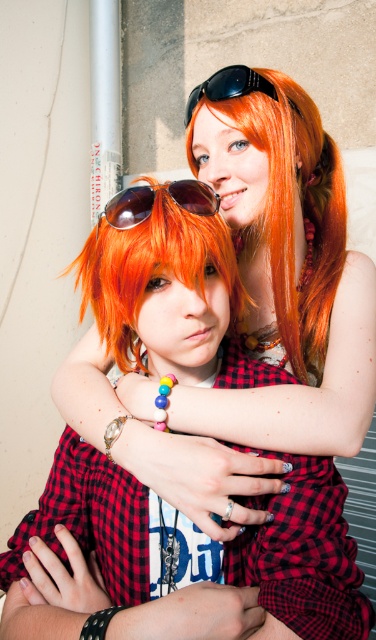
In the scene, you see an orange matte wig at center and sunglasses at center. Which object is positioned to the right of the other?

The orange matte wig at center is to the right of sunglasses at center.

Consider the image. You are a costume designer trying to decide whether to place a new accessory on the multicolored beaded bracelet at upper center or the black plastic goggles at upper center. Which object has a larger width?

The multicolored beaded bracelet at upper center might be wider than black plastic goggles at upper center according to the description, so it could be the better choice for the accessory placement.

You are a photographer at a cosplay event. You need to decide whether to adjust your camera settings for closeup details or wide shots. Based on the size of the multicolored beaded bracelet at upper center and orange matte wig at center, which object would require closer attention for detail capture?

The multicolored beaded bracelet at upper center is larger in size than the orange matte wig at center, so the bracelet would require closer attention for detail capture.